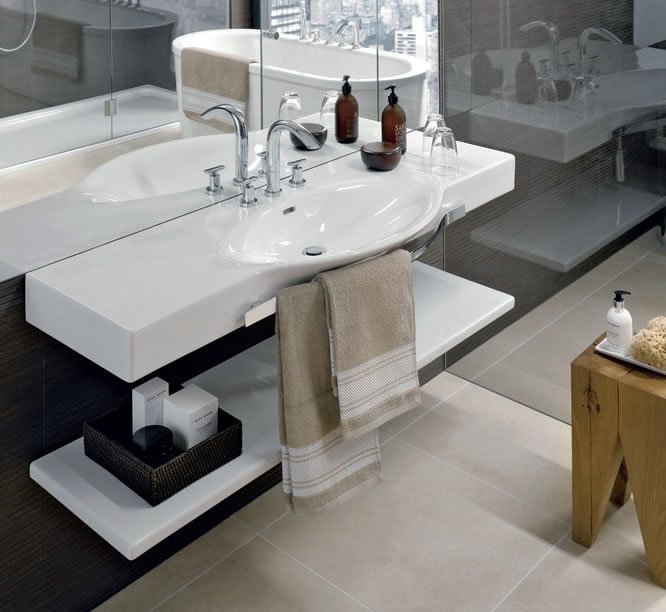
Identify the location of mirror. (64, 177).